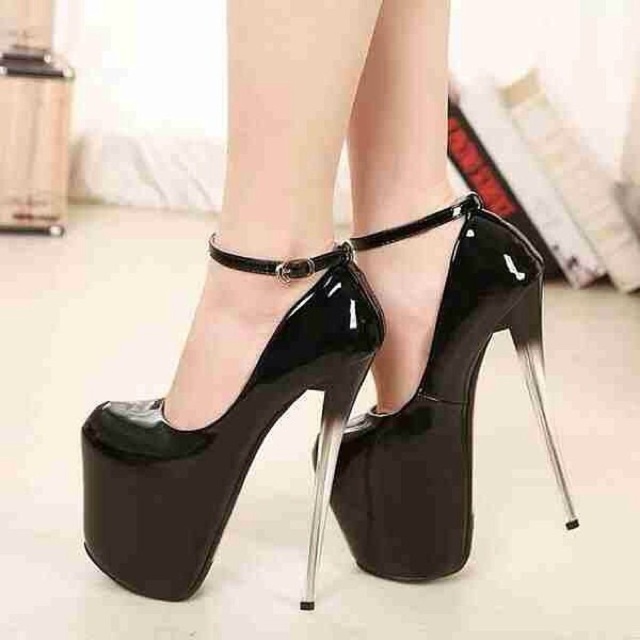
Question: Among these points, which one is nearest to the camera?

Choices:
 (A) (104, 544)
 (B) (417, 509)

Answer: (A)

Question: Which object is farther from the camera taking this photo?

Choices:
 (A) black patent leather high-heeled sandal at center
 (B) black patent leather sandal at center

Answer: (A)

Question: Which of the following is the farthest from the observer?

Choices:
 (A) black patent leather high-heeled sandal at center
 (B) black patent leather sandal at center

Answer: (A)

Question: Can you confirm if black glossy platform shoe at center is wider than black patent leather sandal at center?

Choices:
 (A) yes
 (B) no

Answer: (A)

Question: Can you confirm if black glossy platform shoe at center is positioned to the left of black patent leather high-heeled sandal at center?

Choices:
 (A) no
 (B) yes

Answer: (B)

Question: Does black glossy platform shoe at center appear over black patent leather high-heeled sandal at center?

Choices:
 (A) yes
 (B) no

Answer: (A)